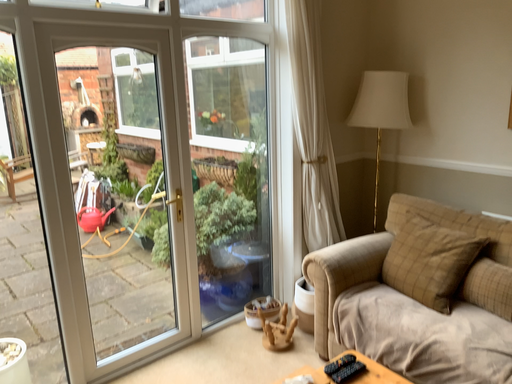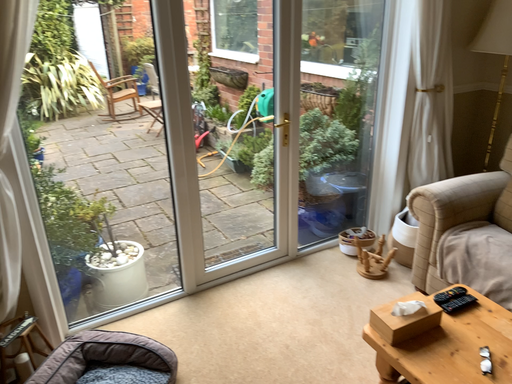
Question: How did the camera likely rotate when shooting the video?

Choices:
 (A) rotated right
 (B) rotated left

Answer: (B)